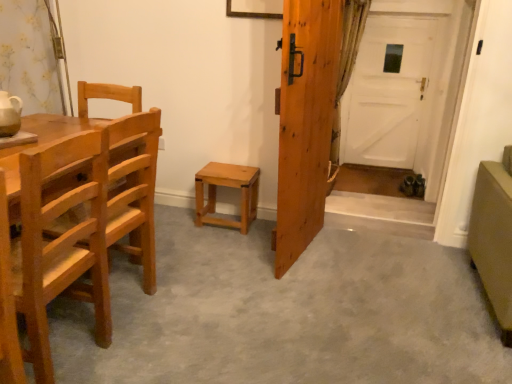
This screenshot has height=384, width=512. I want to click on vacant space in between wooden door at center, the first door viewed from the front, and light brown wood stool at center, so click(x=247, y=239).